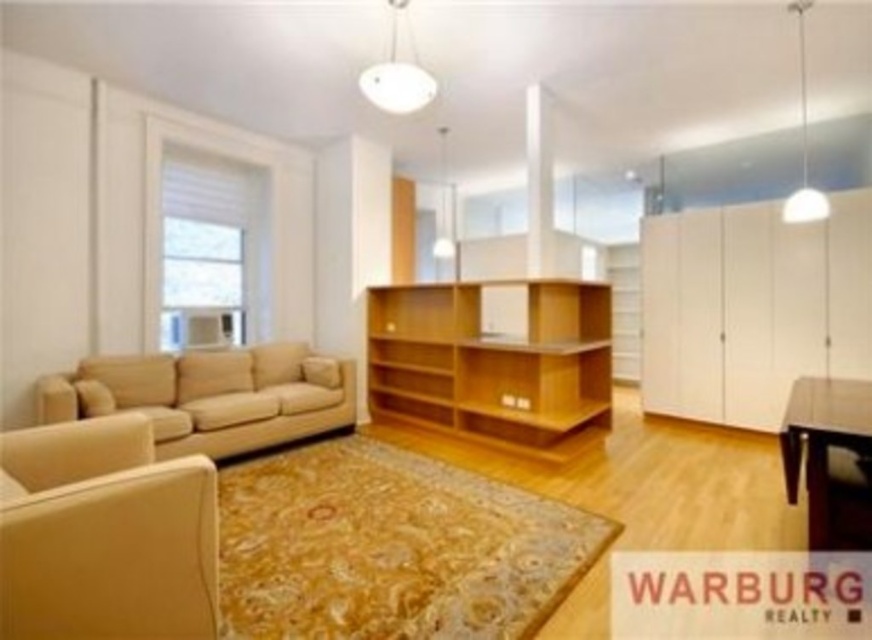
Question: Which point appears farthest from the camera in this image?

Choices:
 (A) (815, 454)
 (B) (128, 449)
 (C) (536, 348)

Answer: (C)

Question: Does light wood/texture bookshelf at center have a greater width compared to dark brown wooden table at lower right?

Choices:
 (A) yes
 (B) no

Answer: (A)

Question: Which object is positioned closest to the dark brown wooden table at lower right?

Choices:
 (A) light wood/texture bookshelf at center
 (B) matte beige armchair at lower left
 (C) beige fabric couch at lower left

Answer: (A)

Question: Among these points, which one is farthest from the camera?

Choices:
 (A) (380, 355)
 (B) (50, 387)
 (C) (823, 467)
 (D) (185, 570)

Answer: (A)

Question: Is the position of matte beige armchair at lower left less distant than that of dark brown wooden table at lower right?

Choices:
 (A) no
 (B) yes

Answer: (B)

Question: Is matte beige armchair at lower left above dark brown wooden table at lower right?

Choices:
 (A) no
 (B) yes

Answer: (A)